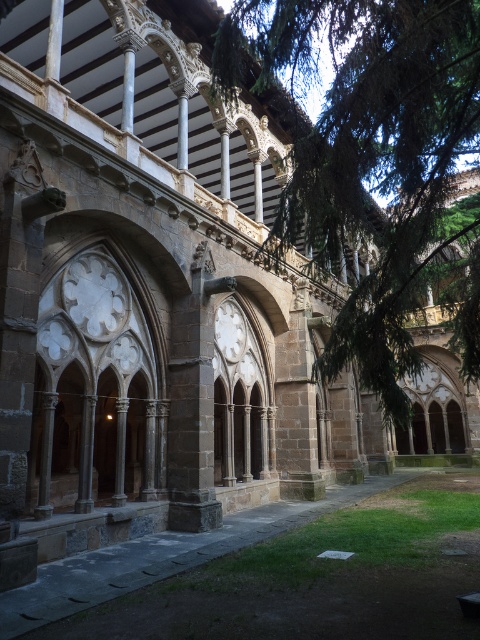
Does green leafy tree at center have a lesser width compared to brown stone walkway at lower center?

In fact, green leafy tree at center might be wider than brown stone walkway at lower center.

Does green leafy tree at center appear over brown stone walkway at lower center?

Correct, green leafy tree at center is located above brown stone walkway at lower center.

Describe the element at coordinates (376, 164) in the screenshot. The height and width of the screenshot is (640, 480). I see `green leafy tree at center` at that location.

Where is `green leafy tree at center`? green leafy tree at center is located at coordinates (376, 164).